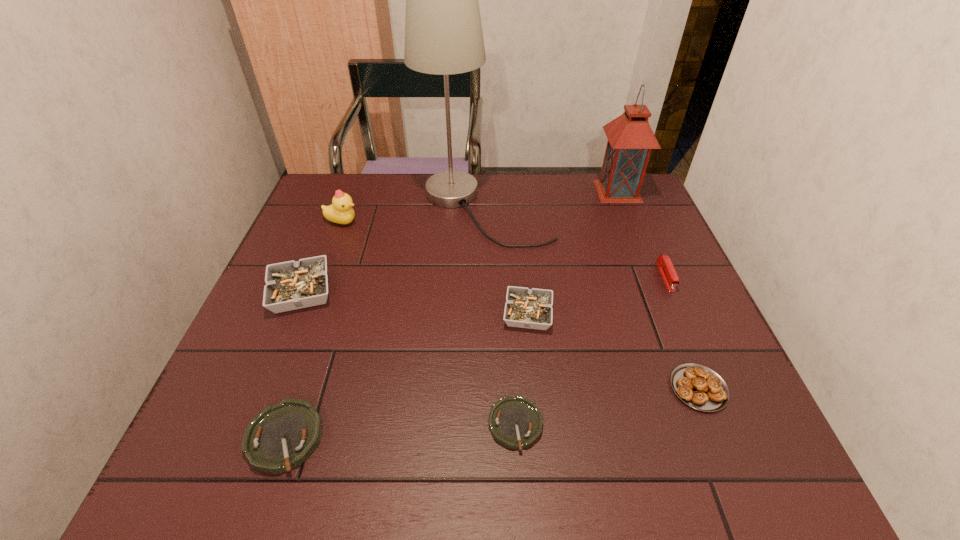
Find the location of a particular element. Image resolution: width=960 pixels, height=540 pixels. the eighth closest object to the third tallest ashtray is located at coordinates (630, 141).

At what (x,y) coordinates should I click in order to perform the action: click on object identified as the eighth closest to the pink lantern. Please return your answer as a coordinate pair (x, y). The height and width of the screenshot is (540, 960). Looking at the image, I should click on (283, 436).

Identify the location of the third closest ashtray to the bigger gray ashtray. This screenshot has height=540, width=960. (515, 422).

Identify which ashtray is the second nearest to the third tallest ashtray. Please provide its 2D coordinates. Your answer should be formatted as a tuple, i.e. [(x, y)], where the tuple contains the x and y coordinates of a point satisfying the conditions above.

[(515, 422)]

Identify the location of free location that satisfies the following two spatial constraints: 1. on the front-facing side of the duckling; 2. on the right side of the pastry. (281, 388).

Identify the location of free spot that satisfies the following two spatial constraints: 1. on the back side of the bigger green ashtray; 2. on the left side of the third shortest ashtray. The height and width of the screenshot is (540, 960). (326, 314).